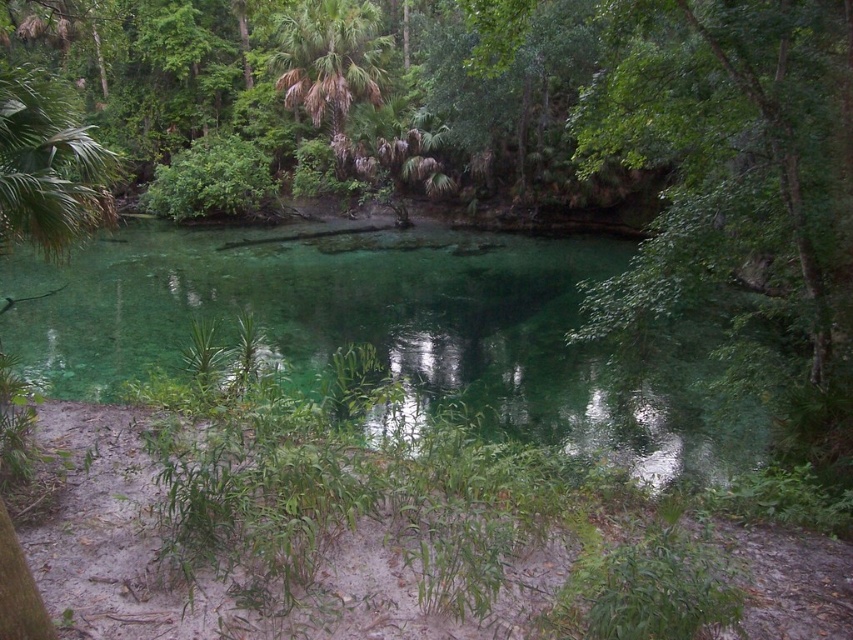
Question: Estimate the real-world distances between objects in this image. Which object is farther from the green leafy tree at center?

Choices:
 (A) clear glassy water at center
 (B) green leafy palm tree at upper center

Answer: (B)

Question: Can you confirm if clear glassy water at center is smaller than green leafy palm tree at upper center?

Choices:
 (A) yes
 (B) no

Answer: (B)

Question: Is clear glassy water at center above green leafy palm tree at upper center?

Choices:
 (A) yes
 (B) no

Answer: (B)

Question: From the image, what is the correct spatial relationship of clear glassy water at center in relation to green leafy tree at center?

Choices:
 (A) left
 (B) right

Answer: (A)

Question: Which point is closer to the camera?

Choices:
 (A) (769, 154)
 (B) (323, 104)
 (C) (762, 435)

Answer: (A)

Question: Estimate the real-world distances between objects in this image. Which object is farther from the green leafy tree at center?

Choices:
 (A) clear glassy water at center
 (B) green leafy palm tree at upper center

Answer: (B)